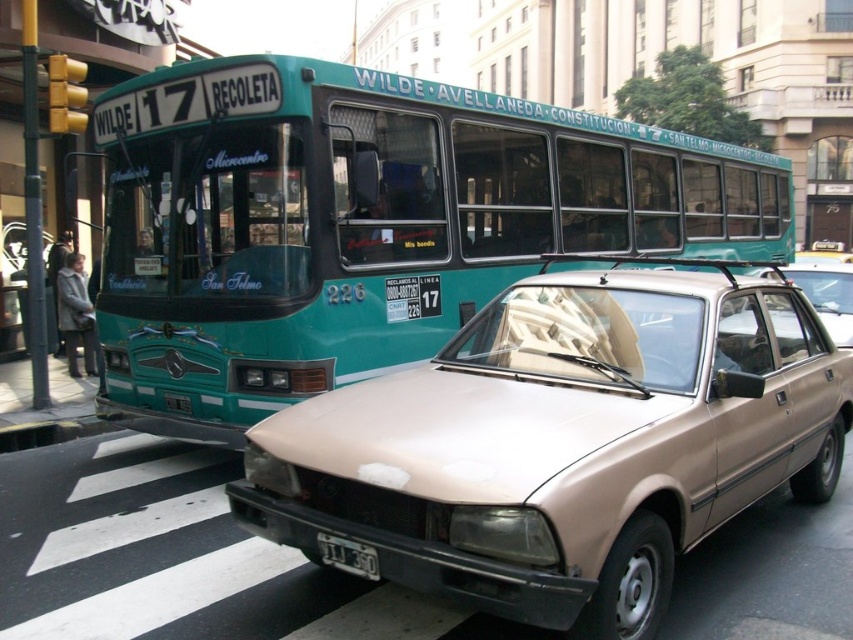
You are a delivery person who needs to load a package onto a truck. You see the teal glossy bus at upper left and the white plastic license plate at lower center. Which object is taller and can accommodate the package?

The teal glossy bus at upper left is taller than the white plastic license plate at lower center, so it can accommodate the package.

You are a delivery person who needs to load a package onto a truck that is parked 5 meters away from the teal glossy bus at upper left. Can you reach the truck without moving the white plastic license plate at lower center?

The teal glossy bus at upper left is 4.53 meters from the white plastic license plate at lower center. Since the truck is parked 5 meters away from the bus, the total distance from the license plate to the truck would be 4.53 meters plus 5 meters, totaling 9.53 meters. Therefore, you can reach the truck without needing to move the white plastic license plate at lower center as they are not in the same location.